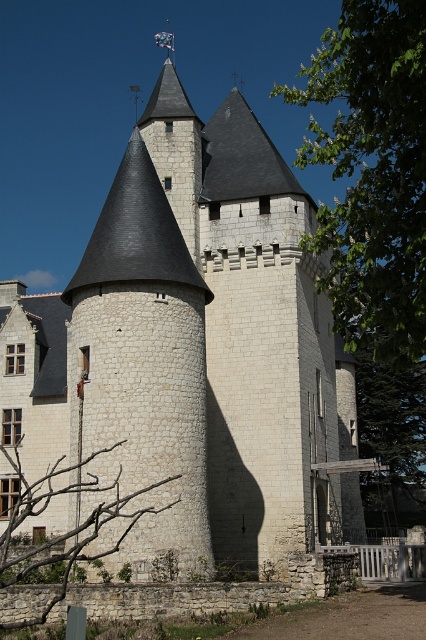
You are standing in front of the historic stone building and want to determine the relative positions of two points marked on the structure. Which of the two points, point 1 at coordinates point [419,305] or point 2 at coordinates point [40,618], is closer to you?

Point 1 at coordinates point [419,305] is closer to the viewer than point 2 at coordinates point [40,618].

You are standing 30 meters away from a historic stone building. A point labeled as point (359, 289) is marked on the building. Can you reach this point without moving closer than your current distance?

The distance of point (359, 289) from viewer is 40.06 meters. Since you are currently 30 meters away, you are already closer than the point, so you would need to move further back to reach it. Therefore, you cannot reach the point without moving farther away.

What are the coordinates of the green leafy tree at upper right in the image?

The green leafy tree at upper right is located at coordinates point (371,173).